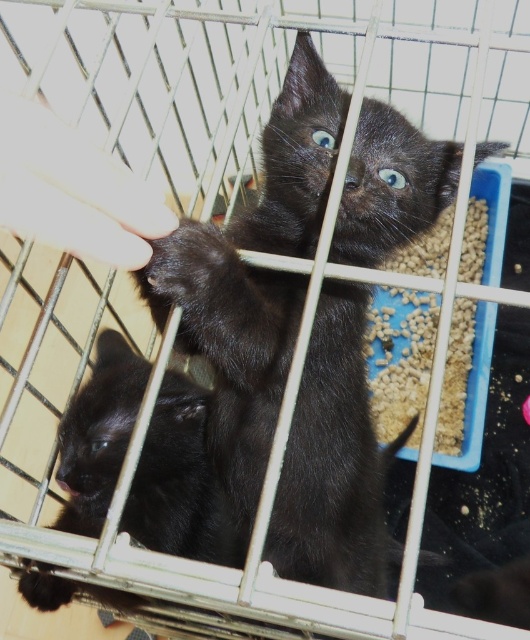
Question: Is shiny black kitten at center below smooth skin hand at upper left?

Choices:
 (A) no
 (B) yes

Answer: (B)

Question: Can you confirm if shiny black kitten at center is smaller than smooth skin hand at upper left?

Choices:
 (A) yes
 (B) no

Answer: (B)

Question: Is shiny black kitten at center above shiny black kitten at lower left?

Choices:
 (A) yes
 (B) no

Answer: (A)

Question: Which object is positioned closest to the smooth skin hand at upper left?

Choices:
 (A) shiny black kitten at center
 (B) shiny black kitten at lower left

Answer: (A)

Question: Which point is farther to the camera?

Choices:
 (A) shiny black kitten at lower left
 (B) smooth skin hand at upper left

Answer: (A)

Question: Which point is farther from the camera taking this photo?

Choices:
 (A) (262, 275)
 (B) (122, 268)

Answer: (A)